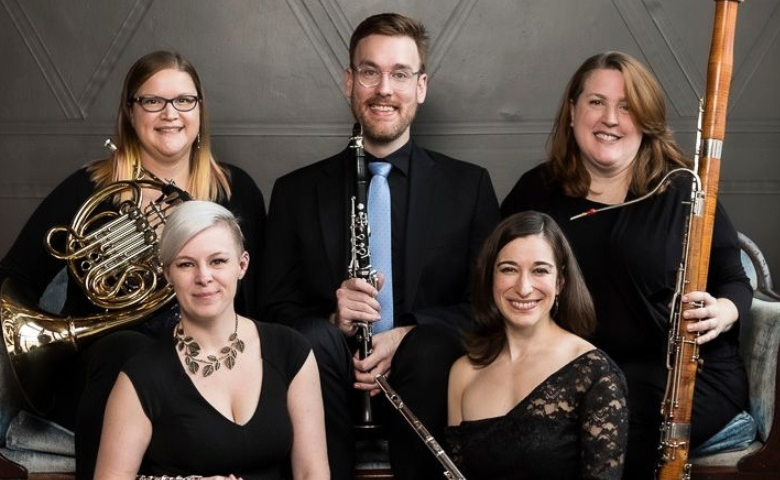
Locate an element on the screen. The image size is (780, 480). wall is located at coordinates (273, 82).